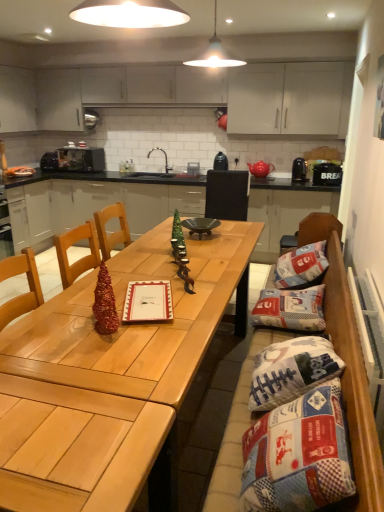
Locate an element on the screen. The image size is (384, 512). unoccupied area in front of shiny metallic christmas tree at center, which is counted as the first christmas tree, starting from the front is located at coordinates (91, 353).